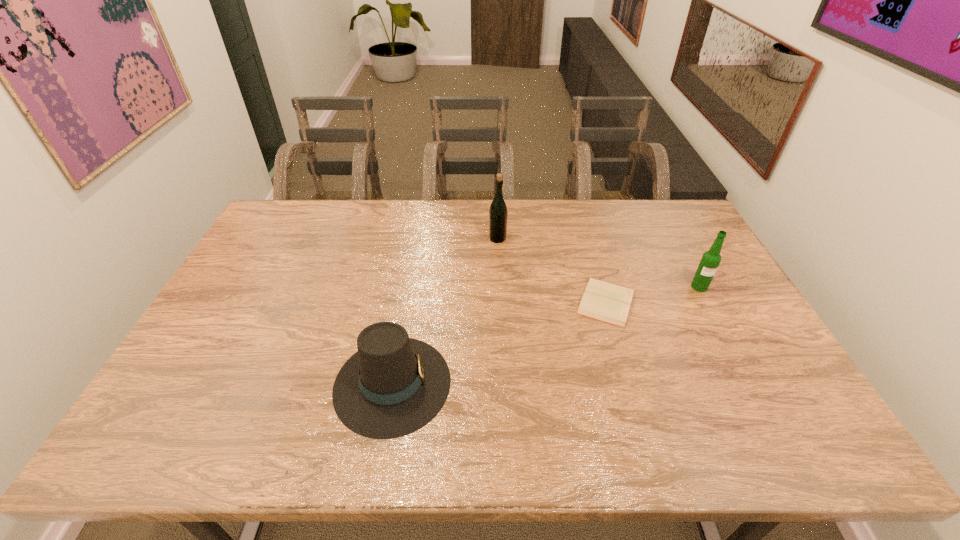
Identify which object is the nearest to the right beer bottle. Please provide its 2D coordinates. Your answer should be formatted as a tuple, i.e. [(x, y)], where the tuple contains the x and y coordinates of a point satisfying the conditions above.

[(606, 302)]

The width and height of the screenshot is (960, 540). In order to click on the closest object to the leftmost object in this screenshot , I will do `click(606, 302)`.

The image size is (960, 540). I want to click on free point that satisfies the following two spatial constraints: 1. on the label of the nearer beer bottle; 2. on the front-facing side of the nearest object, so click(x=751, y=383).

Identify the location of free spot that satisfies the following two spatial constraints: 1. on the front side of the farthest object; 2. on the front-facing side of the leftmost object. This screenshot has height=540, width=960. (505, 383).